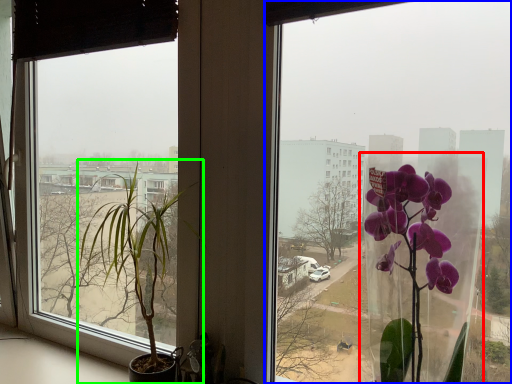
Question: Considering the real-world distances, which object is farthest from glass vase (highlighted by a red box)? window (highlighted by a blue box) or houseplant (highlighted by a green box)?

Choices:
 (A) window
 (B) houseplant

Answer: (A)